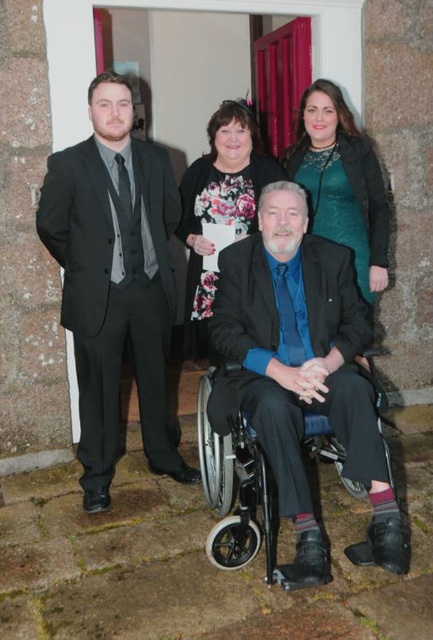
You are a photographer adjusting the camera settings to ensure all four people are in focus. The matte black wheelchair at center is positioned at point A. Where should you focus the camera to include the seated person and the three standing individuals in the same plane of focus?

The camera should be focused at the midpoint between the closest and farthest subjects to ensure all are in focus. Since the matte black wheelchair at center is at point A, focus there as it is central to the group.

You are a photographer adjusting the camera settings to ensure all subjects are in focus. The camera has a depth of field that can cover 80 centimeters. Given the distance between the matte black wheelchair at center and the floral fabric dress at upper center, will the depth of field be sufficient to keep both in focus?

The distance between the matte black wheelchair at center and the floral fabric dress at upper center is 75.96 centimeters. Since the camera has a depth of field of 80 centimeters, which is slightly larger than the distance between them, the depth of field will be sufficient to keep both subjects in focus.